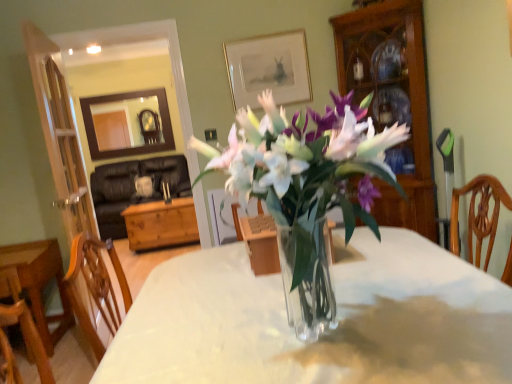
Question: Does clear glass vase at center have a lesser width compared to transparent glass vase at center?

Choices:
 (A) yes
 (B) no

Answer: (A)

Question: Can you confirm if clear glass vase at center is taller than transparent glass vase at center?

Choices:
 (A) yes
 (B) no

Answer: (B)

Question: Considering the relative sizes of clear glass vase at center and transparent glass vase at center in the image provided, is clear glass vase at center bigger than transparent glass vase at center?

Choices:
 (A) yes
 (B) no

Answer: (B)

Question: Considering the relative positions of clear glass vase at center and transparent glass vase at center in the image provided, is clear glass vase at center to the right of transparent glass vase at center from the viewer's perspective?

Choices:
 (A) no
 (B) yes

Answer: (A)

Question: From a real-world perspective, is clear glass vase at center positioned over transparent glass vase at center based on gravity?

Choices:
 (A) no
 (B) yes

Answer: (B)

Question: Is clear glass vase at center smaller than transparent glass vase at center?

Choices:
 (A) yes
 (B) no

Answer: (A)

Question: Is gold-framed picture at upper center not within wooden chest at center, which ranks as the second table in front-to-back order?

Choices:
 (A) no
 (B) yes

Answer: (B)

Question: Can you confirm if gold-framed picture at upper center is smaller than wooden chest at center, which ranks as the second table in front-to-back order?

Choices:
 (A) no
 (B) yes

Answer: (B)

Question: Considering the relative positions of gold-framed picture at upper center and wooden chest at center, which ranks as the 1th table in back-to-front order, in the image provided, is gold-framed picture at upper center to the left of wooden chest at center, which ranks as the 1th table in back-to-front order, from the viewer's perspective?

Choices:
 (A) no
 (B) yes

Answer: (A)

Question: Is gold-framed picture at upper center positioned in front of wooden chest at center, which ranks as the 1th table in back-to-front order?

Choices:
 (A) yes
 (B) no

Answer: (A)

Question: Can wooden chest at center, which ranks as the 1th table in back-to-front order, be found inside gold-framed picture at upper center?

Choices:
 (A) no
 (B) yes

Answer: (A)

Question: Does gold-framed picture at upper center have a greater height compared to wooden chest at center, which ranks as the 1th table in back-to-front order?

Choices:
 (A) no
 (B) yes

Answer: (B)

Question: Is clear glass vase at center wider than wooden cabinet at right?

Choices:
 (A) yes
 (B) no

Answer: (A)